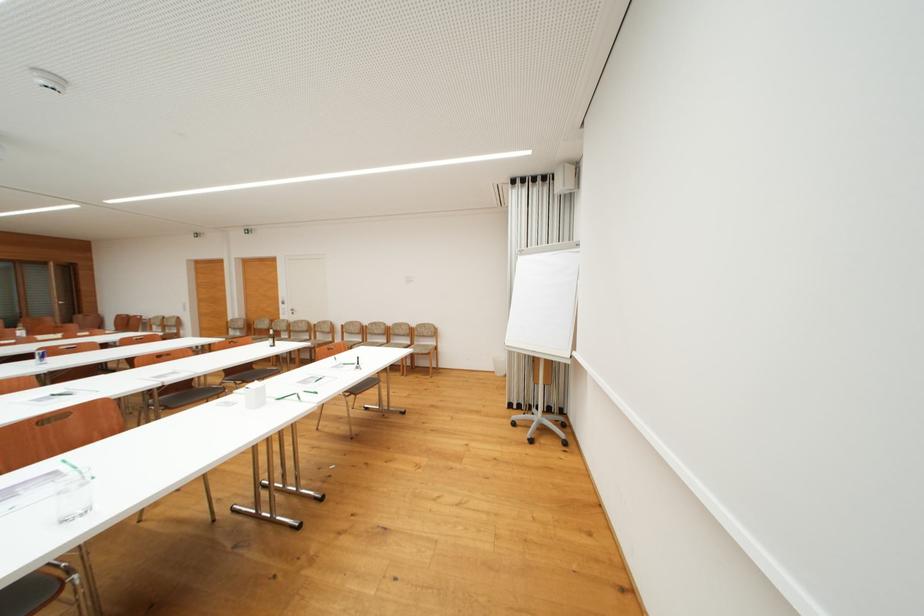
Which object does [73,493] point to?

This point indicates the glass water pitcher.